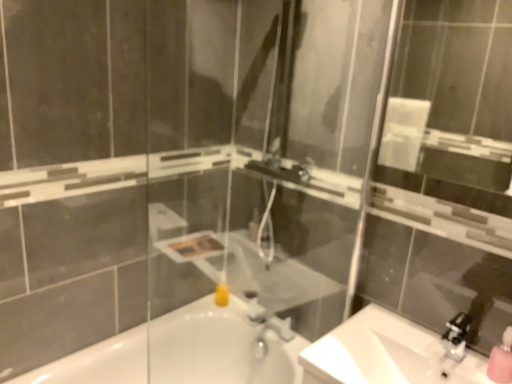
Identify the location of free spot to the left of satin nickel faucet at lower right. The width and height of the screenshot is (512, 384). (396, 340).